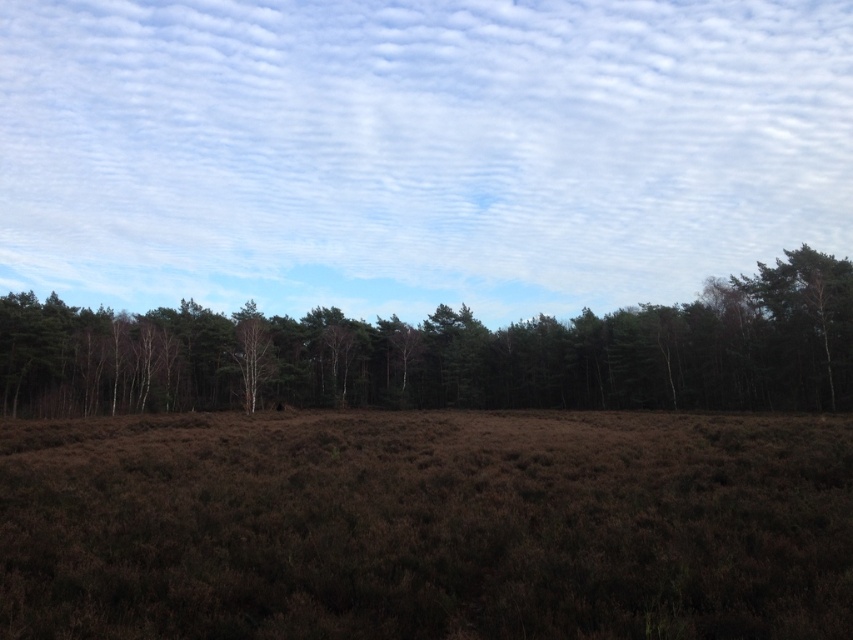
In the scene shown: Is brown textured trees at center positioned at the back of white bark tree at center?

No, it is in front of white bark tree at center.

Describe the element at coordinates (593, 352) in the screenshot. I see `brown textured trees at center` at that location.

Locate an element on the screen. The width and height of the screenshot is (853, 640). brown textured trees at center is located at coordinates (593, 352).

The image size is (853, 640). Identify the location of brown textured trees at center. (593, 352).

Who is more forward, (757,221) or (529,564)?

Point (529,564) is more forward.

Is white fluffy cloud at upper center bigger than brown grassland at center?

Indeed, white fluffy cloud at upper center has a larger size compared to brown grassland at center.

What do you see at coordinates (416, 148) in the screenshot? This screenshot has width=853, height=640. I see `white fluffy cloud at upper center` at bounding box center [416, 148].

The width and height of the screenshot is (853, 640). I want to click on white fluffy cloud at upper center, so click(416, 148).

Is white fluffy cloud at upper center positioned at the back of white bark tree at center?

Yes, white fluffy cloud at upper center is behind white bark tree at center.

Who is shorter, white fluffy cloud at upper center or white bark tree at center?

Answer: Standing shorter between the two is white bark tree at center.

Does point (624, 141) come closer to viewer compared to point (236, 324)?

No, it is not.

Find the location of `white fluffy cloud at upper center`. white fluffy cloud at upper center is located at coordinates (416, 148).